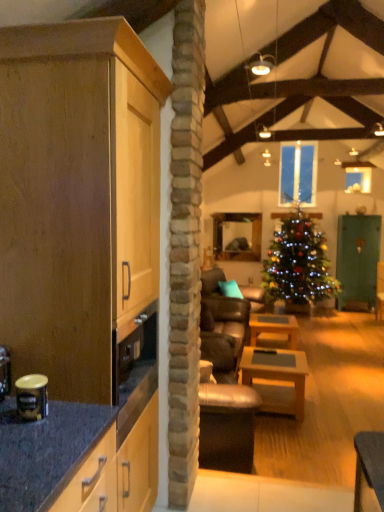
Question: Is clear glass window at center oriented towards light wood cabinet at left?

Choices:
 (A) yes
 (B) no

Answer: (A)

Question: Is clear glass window at center positioned in front of light wood cabinet at left?

Choices:
 (A) yes
 (B) no

Answer: (B)

Question: Is clear glass window at center at the right side of light wood cabinet at left?

Choices:
 (A) no
 (B) yes

Answer: (B)

Question: Is clear glass window at center shorter than light wood cabinet at left?

Choices:
 (A) no
 (B) yes

Answer: (B)

Question: From the image's perspective, is clear glass window at center on light wood cabinet at left?

Choices:
 (A) no
 (B) yes

Answer: (B)

Question: From a real-world perspective, is wooden table at center, which is the 1th table in front-to-back order, positioned above or below metallic gold canister at left?

Choices:
 (A) above
 (B) below

Answer: (B)

Question: Do you think wooden table at center, acting as the second table starting from the back, is within metallic gold canister at left, or outside of it?

Choices:
 (A) inside
 (B) outside

Answer: (B)

Question: Is wooden table at center, which is the 1th table in front-to-back order, to the left or to the right of metallic gold canister at left in the image?

Choices:
 (A) right
 (B) left

Answer: (A)

Question: From their relative heights in the image, would you say wooden table at center, acting as the second table starting from the back, is taller or shorter than metallic gold canister at left?

Choices:
 (A) short
 (B) tall

Answer: (B)

Question: From a real-world perspective, is metallic gold canister at left positioned above or below teal fabric pillow at center?

Choices:
 (A) below
 (B) above

Answer: (B)

Question: Is metallic gold canister at left situated inside teal fabric pillow at center or outside?

Choices:
 (A) inside
 (B) outside

Answer: (B)

Question: Would you say metallic gold canister at left is to the left or to the right of teal fabric pillow at center in the picture?

Choices:
 (A) right
 (B) left

Answer: (B)

Question: Considering the positions of metallic gold canister at left and teal fabric pillow at center in the image, is metallic gold canister at left taller or shorter than teal fabric pillow at center?

Choices:
 (A) tall
 (B) short

Answer: (B)

Question: Is shiny green christmas tree at center inside the boundaries of green matte cabinet at right, or outside?

Choices:
 (A) outside
 (B) inside

Answer: (A)

Question: Is point (281, 297) closer or farther from the camera than point (380, 241)?

Choices:
 (A) farther
 (B) closer

Answer: (B)